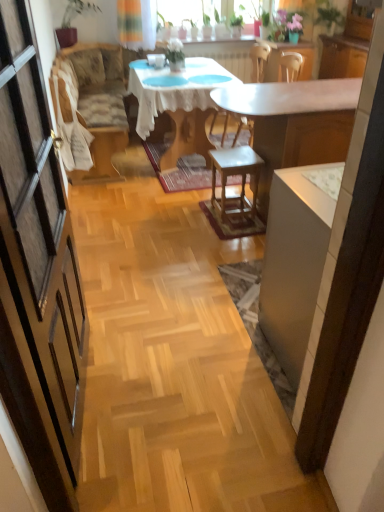
Question: Can you confirm if green matte plant at upper center is wider than wooden stool at center?

Choices:
 (A) no
 (B) yes

Answer: (A)

Question: Is green matte plant at upper center completely or partially outside of wooden stool at center?

Choices:
 (A) no
 (B) yes

Answer: (B)

Question: Is green matte plant at upper center at the left side of wooden stool at center?

Choices:
 (A) yes
 (B) no

Answer: (A)

Question: Does green matte plant at upper center have a larger size compared to wooden stool at center?

Choices:
 (A) no
 (B) yes

Answer: (A)

Question: Is green matte plant at upper center in front of wooden stool at center?

Choices:
 (A) yes
 (B) no

Answer: (B)

Question: Is green matte plant at upper center further to the viewer compared to wooden stool at center?

Choices:
 (A) no
 (B) yes

Answer: (B)

Question: Can you confirm if white lace tablecloth at center is wider than white glossy desk at center?

Choices:
 (A) no
 (B) yes

Answer: (B)

Question: Is white lace tablecloth at center taller than white glossy desk at center?

Choices:
 (A) no
 (B) yes

Answer: (A)

Question: Is white lace tablecloth at center directly adjacent to white glossy desk at center?

Choices:
 (A) no
 (B) yes

Answer: (A)

Question: Is white lace tablecloth at center further to camera compared to white glossy desk at center?

Choices:
 (A) no
 (B) yes

Answer: (B)

Question: From the image's perspective, is white lace tablecloth at center above white glossy desk at center?

Choices:
 (A) yes
 (B) no

Answer: (A)

Question: Could you tell me if white lace tablecloth at center is turned towards white glossy desk at center?

Choices:
 (A) yes
 (B) no

Answer: (B)

Question: Considering the relative positions of white glossy desk at center and white glossy cabinet at right in the image provided, is white glossy desk at center behind white glossy cabinet at right?

Choices:
 (A) no
 (B) yes

Answer: (B)